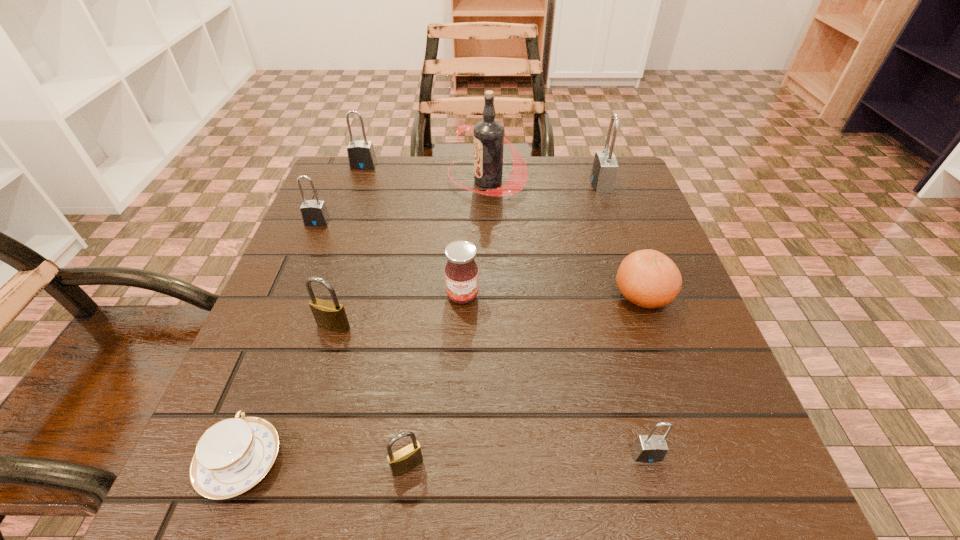
In order to click on gray padlock that is the fourth closest to the tallest object in this screenshot , I will do `click(650, 448)`.

Point out which gray padlock is positioned as the third nearest to the tallest padlock. Please provide its 2D coordinates. Your answer should be formatted as a tuple, i.e. [(x, y)], where the tuple contains the x and y coordinates of a point satisfying the conditions above.

[(650, 448)]

Identify the location of free space that satisfies the following two spatial constraints: 1. on the label of the tallest object; 2. on the shackle of the second smallest gray padlock. This screenshot has width=960, height=540. (488, 222).

You are a GUI agent. You are given a task and a screenshot of the screen. Output one action in this format:
    pyautogui.click(x=<x>, y=<y>)
    Task: Click on the free space that satisfies the following two spatial constraints: 1. on the shackle of the clementine; 2. on the right side of the second tallest padlock
    This screenshot has width=960, height=540.
    Given the screenshot: What is the action you would take?
    pyautogui.click(x=318, y=295)

The image size is (960, 540). In order to click on vacant region that satisfies the following two spatial constraints: 1. on the shackle of the fifth shortest padlock; 2. on the right side of the third nearest padlock in this screenshot , I will do `click(307, 326)`.

The height and width of the screenshot is (540, 960). What are the coordinates of `vacant space that satisfies the following two spatial constraints: 1. on the shackle of the farthest padlock; 2. on the right side of the smaller brass padlock` in the screenshot? It's located at (258, 465).